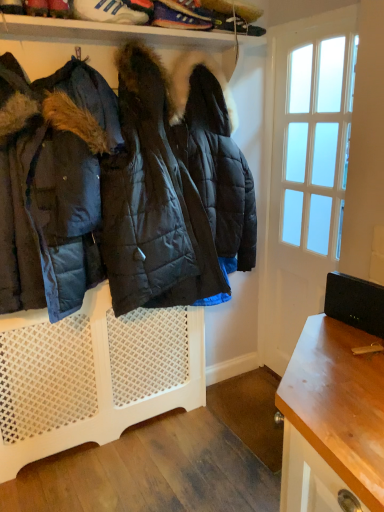
Find the location of a particular element. Image resolution: width=384 pixels, height=512 pixels. white suede sneakers at upper center, which is the 1th footwear in left-to-right order is located at coordinates (108, 12).

Find the location of `shiny leather sneaker at upper left`. shiny leather sneaker at upper left is located at coordinates (59, 8).

Image resolution: width=384 pixels, height=512 pixels. Describe the element at coordinates (120, 188) in the screenshot. I see `matte black jacket at left` at that location.

Measure the distance between white mesh radiator at center and camera.

white mesh radiator at center and camera are 1.78 meters apart from each other.

This screenshot has width=384, height=512. I want to click on white suede sneakers at upper center, which is the 1th footwear in left-to-right order, so click(108, 12).

Would you say shiny leather sneaker at upper left is to the left or to the right of white mesh radiator at center in the picture?

From the image, it's evident that shiny leather sneaker at upper left is to the left of white mesh radiator at center.

Is shiny leather sneaker at upper left positioned far away from white mesh radiator at center?

That's right, there is a large distance between shiny leather sneaker at upper left and white mesh radiator at center.

How many degrees apart are the facing directions of shiny leather sneaker at upper left and white mesh radiator at center?

2.86 degrees separate the facing orientations of shiny leather sneaker at upper left and white mesh radiator at center.

From a real-world perspective, is blue suede sneakers at upper center, the 1th footwear when ordered from right to left, located beneath matte black jacket at left?

Incorrect, from a real-world perspective, blue suede sneakers at upper center, the 1th footwear when ordered from right to left, is higher than matte black jacket at left.

Which is correct: blue suede sneakers at upper center, which appears as the second footwear when viewed from the left, is inside matte black jacket at left, or outside of it?

blue suede sneakers at upper center, which appears as the second footwear when viewed from the left, cannot be found inside matte black jacket at left.

From the image's perspective, is blue suede sneakers at upper center, which appears as the second footwear when viewed from the left, below matte black jacket at left?

Incorrect, from the image's perspective, blue suede sneakers at upper center, which appears as the second footwear when viewed from the left, is higher than matte black jacket at left.

Which of these two, blue suede sneakers at upper center, which appears as the second footwear when viewed from the left, or shiny leather sneaker at upper left, is wider?

With larger width is shiny leather sneaker at upper left.

Can you confirm if blue suede sneakers at upper center, the 1th footwear when ordered from right to left, is taller than shiny leather sneaker at upper left?

Incorrect, the height of blue suede sneakers at upper center, the 1th footwear when ordered from right to left, is not larger of that of shiny leather sneaker at upper left.

From a real-world perspective, between blue suede sneakers at upper center, which appears as the second footwear when viewed from the left, and shiny leather sneaker at upper left, who is vertically higher?

shiny leather sneaker at upper left, from a real-world perspective.

Considering the relative positions of blue suede sneakers at upper center, which appears as the second footwear when viewed from the left, and white mesh radiator at center in the image provided, is blue suede sneakers at upper center, which appears as the second footwear when viewed from the left, to the left or to the right of white mesh radiator at center?

blue suede sneakers at upper center, which appears as the second footwear when viewed from the left, is positioned on white mesh radiator at center's right side.

Is blue suede sneakers at upper center, which appears as the second footwear when viewed from the left, turned away from white mesh radiator at center?

No.

Would you say blue suede sneakers at upper center, which appears as the second footwear when viewed from the left, is inside or outside white mesh radiator at center?

blue suede sneakers at upper center, which appears as the second footwear when viewed from the left, is not enclosed by white mesh radiator at center.

Considering the sizes of blue suede sneakers at upper center, the 1th footwear when ordered from right to left, and white mesh radiator at center in the image, is blue suede sneakers at upper center, the 1th footwear when ordered from right to left, taller or shorter than white mesh radiator at center?

Considering their sizes, blue suede sneakers at upper center, the 1th footwear when ordered from right to left, has less height than white mesh radiator at center.

From their relative heights in the image, would you say white mesh radiator at center is taller or shorter than white suede sneakers at upper center, which is the 1th footwear in left-to-right order?

In the image, white mesh radiator at center appears to be taller than white suede sneakers at upper center, which is the 1th footwear in left-to-right order.

Considering the sizes of objects white mesh radiator at center and white suede sneakers at upper center, which is the 1th footwear in left-to-right order, in the image provided, who is wider, white mesh radiator at center or white suede sneakers at upper center, which is the 1th footwear in left-to-right order,?

With larger width is white mesh radiator at center.

Considering the positions of objects white mesh radiator at center and white suede sneakers at upper center, which is the 1th footwear in left-to-right order, in the image provided, who is in front, white mesh radiator at center or white suede sneakers at upper center, which is the 1th footwear in left-to-right order,?

white suede sneakers at upper center, which is the 1th footwear in left-to-right order.

From a real-world perspective, is white mesh radiator at center on white suede sneakers at upper center, arranged as the 2th footwear when viewed from the right?

No.

From a real-world perspective, is shiny leather sneaker at upper left beneath white suede sneakers at upper center, arranged as the 2th footwear when viewed from the right?

Indeed, from a real-world perspective, shiny leather sneaker at upper left is positioned beneath white suede sneakers at upper center, arranged as the 2th footwear when viewed from the right.

Between shiny leather sneaker at upper left and white suede sneakers at upper center, arranged as the 2th footwear when viewed from the right, which one has smaller size?

Smaller between the two is shiny leather sneaker at upper left.

Which is behind, shiny leather sneaker at upper left or white suede sneakers at upper center, which is the 1th footwear in left-to-right order?

white suede sneakers at upper center, which is the 1th footwear in left-to-right order, is further away from the camera.

Looking at this image, from the image's perspective, between shiny leather sneaker at upper left and white suede sneakers at upper center, which is the 1th footwear in left-to-right order, which one is located above?

white suede sneakers at upper center, which is the 1th footwear in left-to-right order, is shown above in the image.

From a real-world perspective, who is located lower, blue suede sneakers at upper center, the 1th footwear when ordered from right to left, or white suede sneakers at upper center, which is the 1th footwear in left-to-right order?

blue suede sneakers at upper center, the 1th footwear when ordered from right to left, from a real-world perspective.

Does point (160, 25) come in front of point (76, 10)?

No, it is not.

Is blue suede sneakers at upper center, which appears as the second footwear when viewed from the left, beside white suede sneakers at upper center, arranged as the 2th footwear when viewed from the right?

A: blue suede sneakers at upper center, which appears as the second footwear when viewed from the left, and white suede sneakers at upper center, arranged as the 2th footwear when viewed from the right, are not in contact.

The height and width of the screenshot is (512, 384). Identify the location of shelf below the shiny leather sneaker at upper left (from the image's perspective). (93, 375).

The image size is (384, 512). In order to click on footwear on the right side of matte black jacket at left in this screenshot , I will do `click(178, 17)`.

From the image, which object appears to be farther from white suede sneakers at upper center, arranged as the 2th footwear when viewed from the right, blue suede sneakers at upper center, which appears as the second footwear when viewed from the left, or shiny leather sneaker at upper left?

Based on the image, blue suede sneakers at upper center, which appears as the second footwear when viewed from the left, appears to be further to white suede sneakers at upper center, arranged as the 2th footwear when viewed from the right.

Estimate the real-world distances between objects in this image. Which object is closer to white suede sneakers at upper center, arranged as the 2th footwear when viewed from the right, shiny leather sneaker at upper left or white mesh radiator at center?

shiny leather sneaker at upper left.

When comparing their distances from white mesh radiator at center, does matte black jacket at left or white suede sneakers at upper center, arranged as the 2th footwear when viewed from the right, seem further?

white suede sneakers at upper center, arranged as the 2th footwear when viewed from the right, is positioned further to the anchor white mesh radiator at center.

Looking at the image, which one is located further to matte black jacket at left, shiny leather sneaker at upper left or blue suede sneakers at upper center, which appears as the second footwear when viewed from the left?

shiny leather sneaker at upper left.

Based on their spatial positions, is blue suede sneakers at upper center, which appears as the second footwear when viewed from the left, or white mesh radiator at center closer to shiny leather sneaker at upper left?

Among the two, blue suede sneakers at upper center, which appears as the second footwear when viewed from the left, is located nearer to shiny leather sneaker at upper left.

Based on their spatial positions, is white mesh radiator at center or matte black jacket at left further from blue suede sneakers at upper center, which appears as the second footwear when viewed from the left?

The object further to blue suede sneakers at upper center, which appears as the second footwear when viewed from the left, is white mesh radiator at center.

From the image, which object appears to be farther from matte black jacket at left, blue suede sneakers at upper center, the 1th footwear when ordered from right to left, or shiny leather sneaker at upper left?

The object further to matte black jacket at left is shiny leather sneaker at upper left.

When comparing their distances from shiny leather sneaker at upper left, does white mesh radiator at center or white suede sneakers at upper center, which is the 1th footwear in left-to-right order, seem closer?

white suede sneakers at upper center, which is the 1th footwear in left-to-right order, lies closer to shiny leather sneaker at upper left than the other object.

This screenshot has height=512, width=384. Find the location of `shoe between white suede sneakers at upper center, arranged as the 2th footwear when viewed from the right, and matte black jacket at left, in the vertical direction`. shoe between white suede sneakers at upper center, arranged as the 2th footwear when viewed from the right, and matte black jacket at left, in the vertical direction is located at coordinates 59,8.

Locate an element on the screen. The height and width of the screenshot is (512, 384). shoe between blue suede sneakers at upper center, the 1th footwear when ordered from right to left, and white mesh radiator at center from top to bottom is located at coordinates (59, 8).

You are a GUI agent. You are given a task and a screenshot of the screen. Output one action in this format:
    pyautogui.click(x=<x>, y=<y>)
    Task: Click on the footwear between blue suede sneakers at upper center, which appears as the second footwear when viewed from the left, and white mesh radiator at center vertically
    This screenshot has width=384, height=512.
    Given the screenshot: What is the action you would take?
    pyautogui.click(x=108, y=12)

Where is `footwear between shiny leather sneaker at upper left and blue suede sneakers at upper center, which appears as the second footwear when viewed from the left`? This screenshot has height=512, width=384. footwear between shiny leather sneaker at upper left and blue suede sneakers at upper center, which appears as the second footwear when viewed from the left is located at coordinates (108, 12).